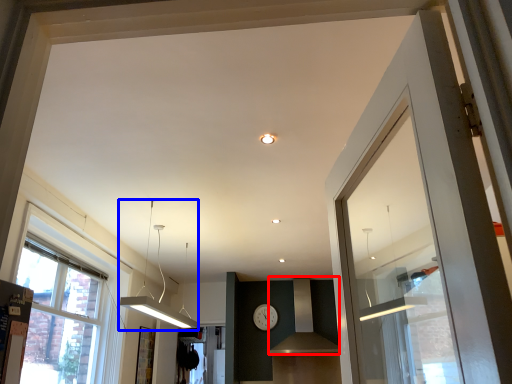
Question: Among these objects, which one is farthest to the camera, vent (highlighted by a red box) or light fixture (highlighted by a blue box)?

Choices:
 (A) vent
 (B) light fixture

Answer: (A)